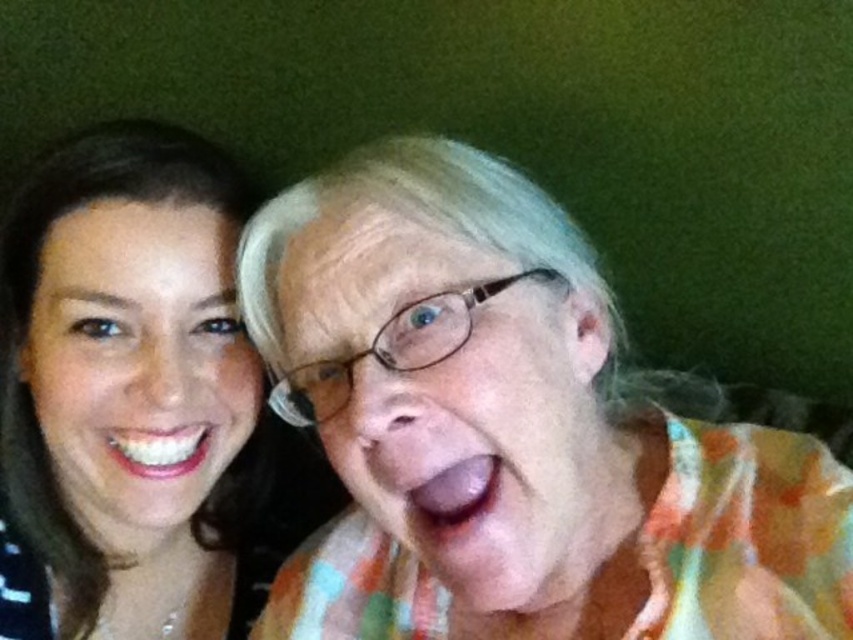
Question: Estimate the real-world distances between objects in this image. Which object is farther from the multicolored floral shirt at upper right?

Choices:
 (A) multicolored fabric at center
 (B) pink glossy tongue at center
 (C) matte skin face at left

Answer: (B)

Question: Can you confirm if multicolored floral shirt at upper right is thinner than matte floral shirt at center?

Choices:
 (A) no
 (B) yes

Answer: (A)

Question: Considering the real-world distances, which object is farthest from the pink glossy tongue at center?

Choices:
 (A) multicolored fabric at center
 (B) white glossy teeth at lower left

Answer: (B)

Question: Among these points, which one is nearest to the camera?

Choices:
 (A) (476, 410)
 (B) (125, 490)
 (C) (146, 448)

Answer: (A)

Question: In this image, where is multicolored fabric at center located relative to matte floral shirt at center?

Choices:
 (A) below
 (B) above

Answer: (A)

Question: Can you confirm if matte skin face at left is thinner than white glossy teeth at lower left?

Choices:
 (A) yes
 (B) no

Answer: (B)